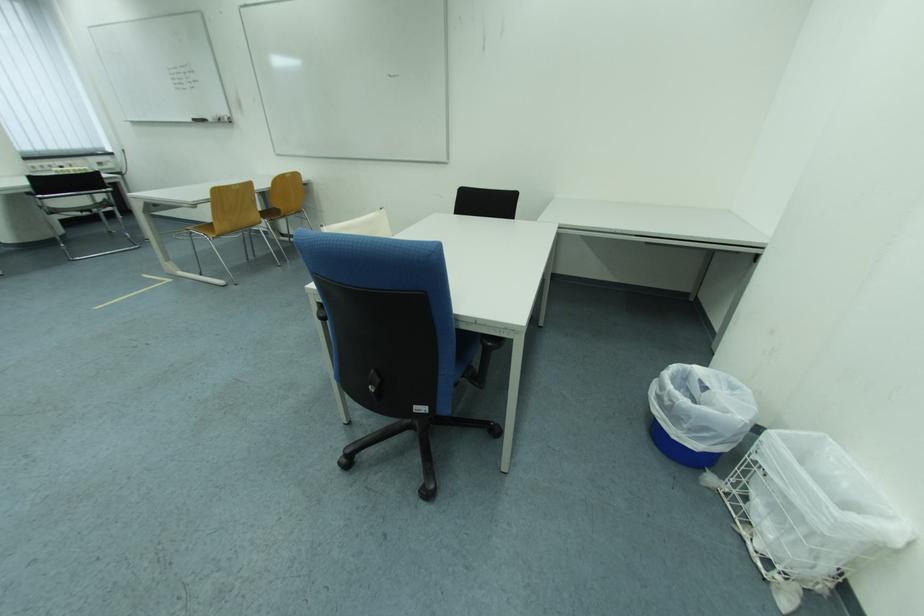
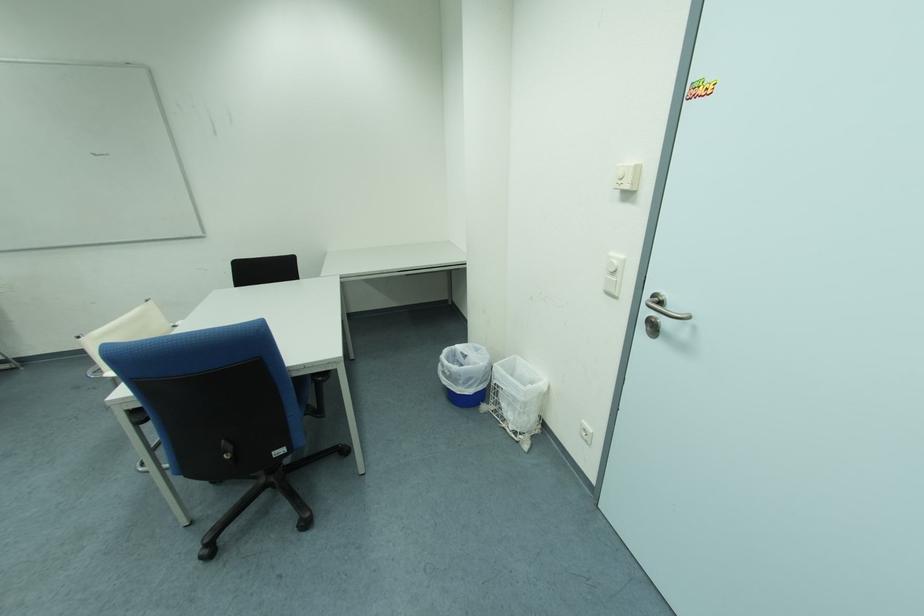
Locate, in the second image, the point that corresponds to point 742,390 in the first image.

(485, 352)